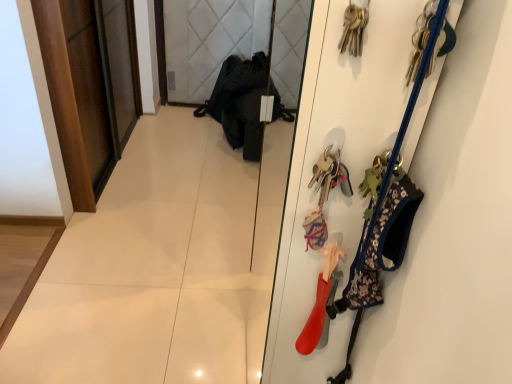
At what (x,y) coordinates should I click in order to perform the action: click on vacant space behind clear glass mirror at center. Please return your answer as a coordinate pair (x, y). Image resolution: width=512 pixels, height=384 pixels. Looking at the image, I should click on tap(237, 177).